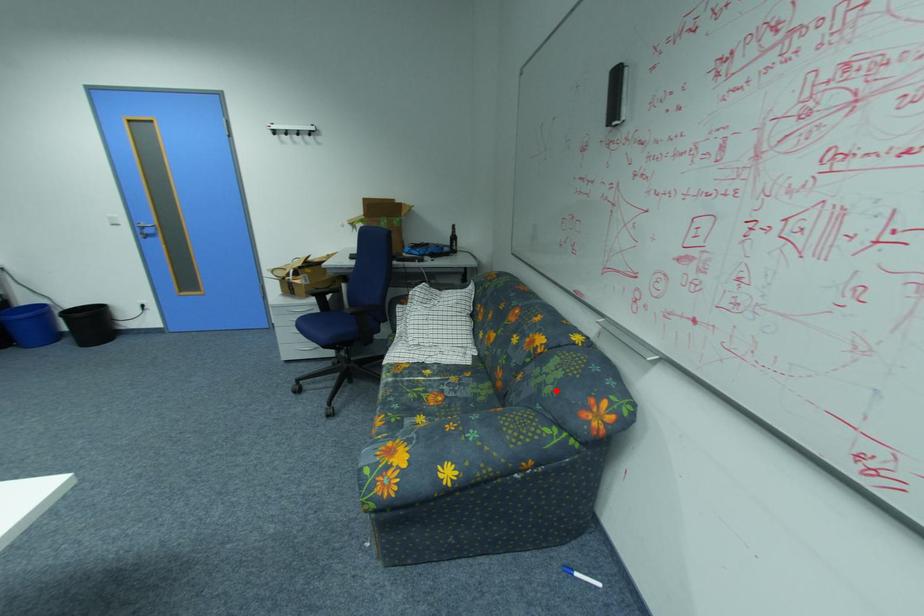
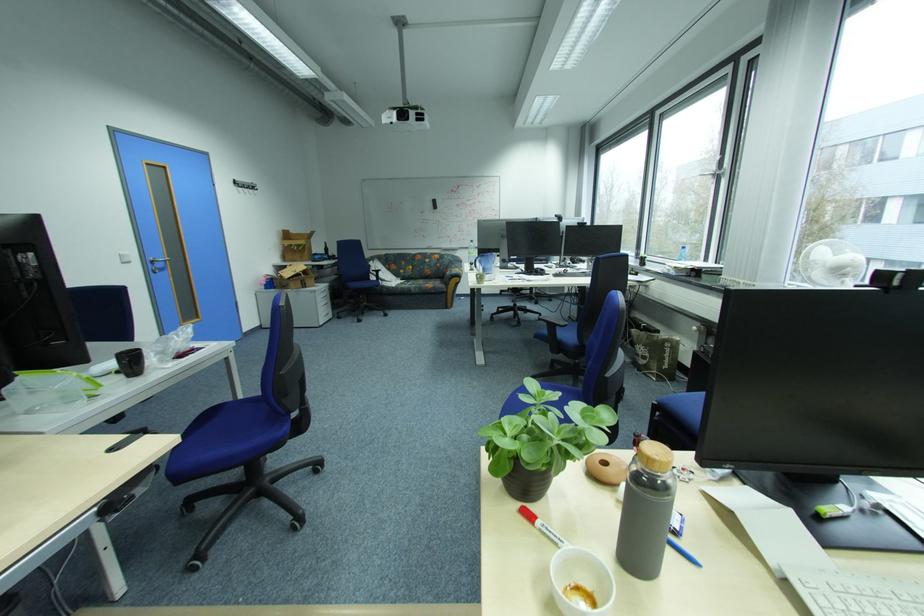
Question: I am providing you with two images of the same scene from different viewpoints. Image1 has a red point marked. In image2, the corresponding 3D location appears at what relative position? Reply with the corresponding letter.

Choices:
 (A) Closer
 (B) Farther

Answer: (A)